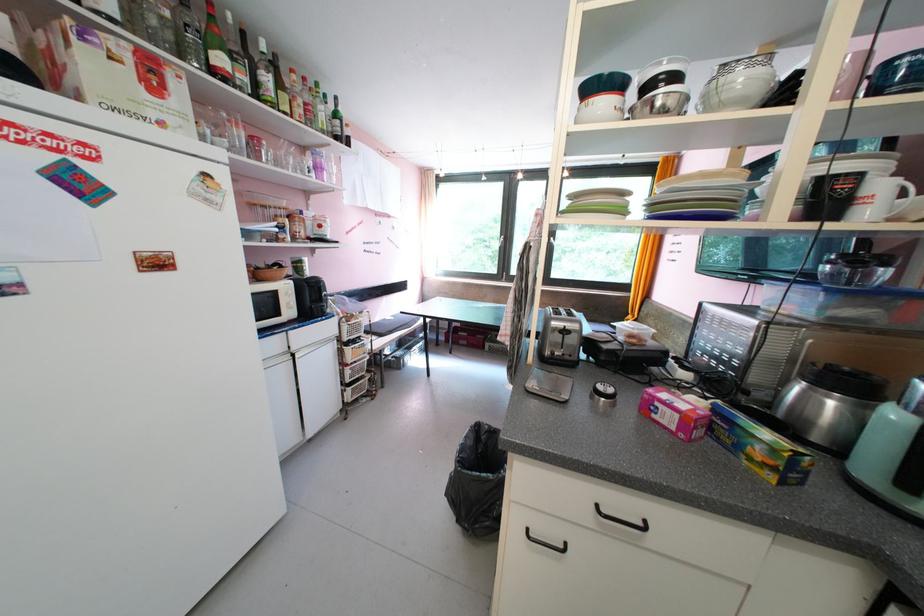
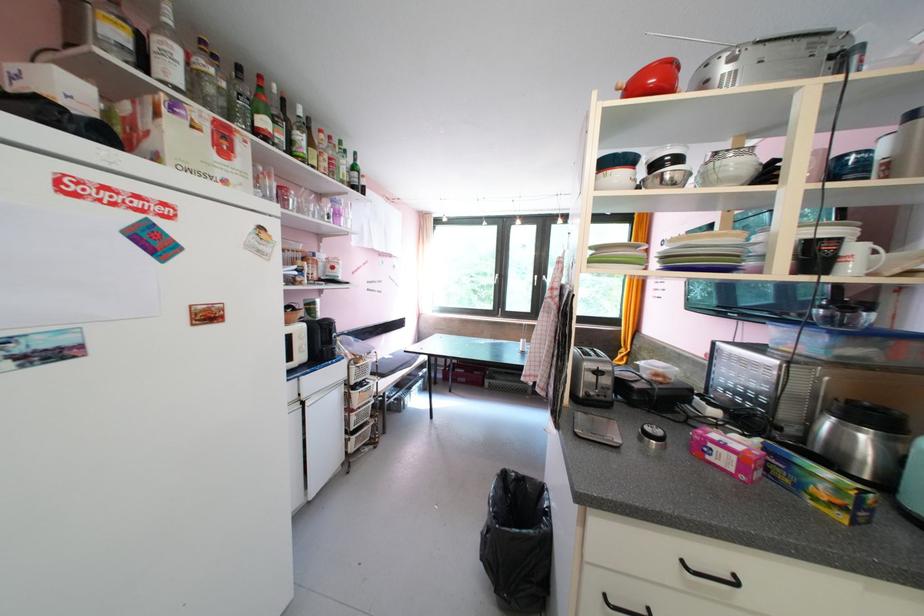
Question: Based on the continuous images, in which direction is the camera rotating? Reply with the corresponding letter.

Choices:
 (A) Left
 (B) Right
 (C) Up
 (D) Down

Answer: (C)